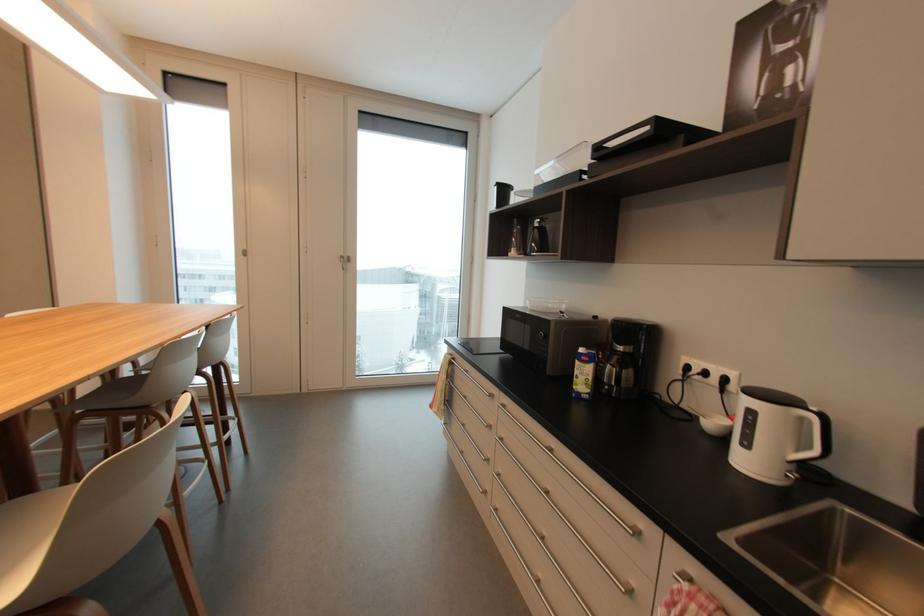
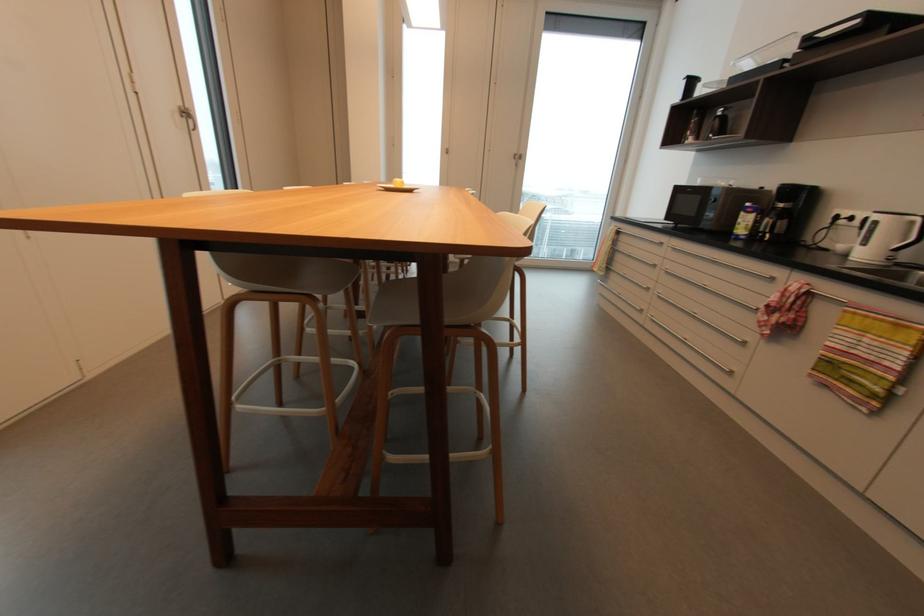
What movement of the cameraman would produce the second image?

The movement direction of the cameraman is left, backward.